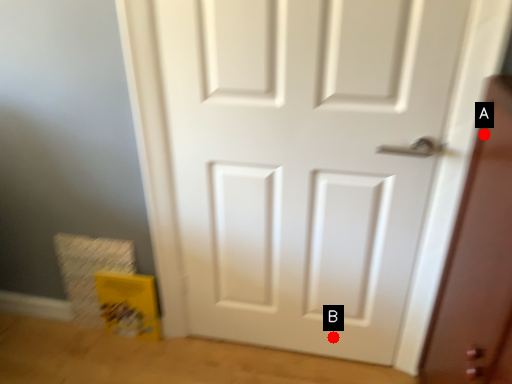
Question: Two points are circled on the image, labeled by A and B beside each circle. Among these points, which one is nearest to the camera?

Choices:
 (A) A is closer
 (B) B is closer

Answer: (A)